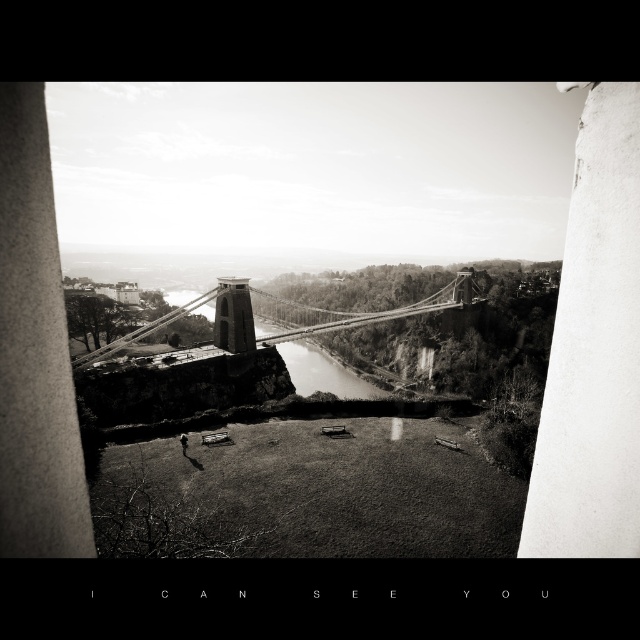
Question: Is smooth concrete pillar at left above smooth water at center?

Choices:
 (A) no
 (B) yes

Answer: (B)

Question: Which object is positioned closest to the metallic wire suspension bridge at center?

Choices:
 (A) white smooth pillar at center right
 (B) smooth water at center
 (C) smooth concrete pillar at left

Answer: (B)

Question: Considering the real-world distances, which object is closest to the metallic wire suspension bridge at center?

Choices:
 (A) white smooth pillar at center right
 (B) smooth concrete pillar at left

Answer: (B)

Question: Is white smooth pillar at center right thinner than smooth water at center?

Choices:
 (A) yes
 (B) no

Answer: (A)

Question: Does smooth concrete pillar at left appear on the right side of metallic wire suspension bridge at center?

Choices:
 (A) no
 (B) yes

Answer: (A)

Question: Which point is closer to the camera taking this photo?

Choices:
 (A) pyautogui.click(x=216, y=285)
 (B) pyautogui.click(x=552, y=433)
 (C) pyautogui.click(x=291, y=342)

Answer: (B)